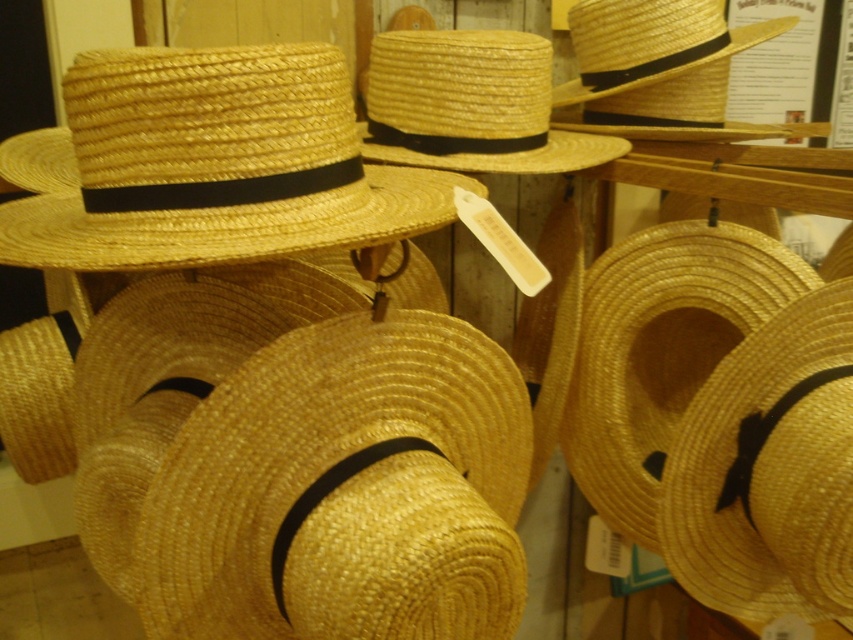
Is natural straw cowboy hat at upper left shorter than natural straw cowboy hat at center?

Correct, natural straw cowboy hat at upper left is not as tall as natural straw cowboy hat at center.

Who is higher up, natural straw cowboy hat at upper left or natural straw cowboy hat at center?

natural straw cowboy hat at center is higher up.

At what (x,y) coordinates should I click in order to perform the action: click on natural straw cowboy hat at upper left. Please return your answer as a coordinate pair (x, y). Looking at the image, I should click on (216, 164).

Find the location of a particular element. natural straw cowboy hat at upper left is located at coordinates (216, 164).

From the picture: Which is more to the left, woven straw hat at center or natural straw cowboy hat at center?

woven straw hat at center is more to the left.

From the picture: Is the position of woven straw hat at center more distant than that of natural straw cowboy hat at center?

No, it is in front of natural straw cowboy hat at center.

Identify the location of woven straw hat at center. (345, 492).

Is point (497, 582) more distant than point (206, 228)?

Yes, it is behind point (206, 228).

Which of these two, woven straw hat at center or natural straw cowboy hat at upper left, stands shorter?

natural straw cowboy hat at upper left

Identify the location of woven straw hat at center. (345, 492).